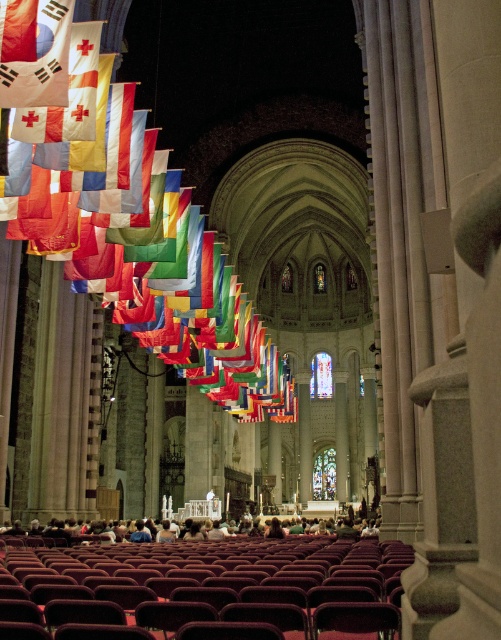
Which is more to the right, velvet maroon chairs at lower center or matte red flag at upper left?

velvet maroon chairs at lower center

Does velvet maroon chairs at lower center have a greater width compared to matte red flag at upper left?

Yes, velvet maroon chairs at lower center is wider than matte red flag at upper left.

Is point (294, 625) less distant than point (23, 92)?

Yes, point (294, 625) is closer to viewer.

Identify the location of velvet maroon chairs at lower center. The height and width of the screenshot is (640, 501). (201, 588).

Between point (109, 227) and point (27, 19), which one is positioned behind?

The point (109, 227) is behind.

From the picture: Between matte white flag at upper left and matte red flag at upper left, which one is positioned higher?

matte red flag at upper left is above.

At what (x,y) coordinates should I click in order to perform the action: click on matte white flag at upper left. Please return your answer as a coordinate pair (x, y). The image size is (501, 640). Looking at the image, I should click on (117, 184).

Does point (234, 609) come in front of point (21, 13)?

Yes, it is.

Who is more forward, (x=80, y=596) or (x=98, y=168)?

Positioned in front is point (x=80, y=596).

Does point (191, 600) lie behind point (31, 148)?

No.

Find the location of a particular element. The height and width of the screenshot is (640, 501). velvet maroon chairs at lower center is located at coordinates (201, 588).